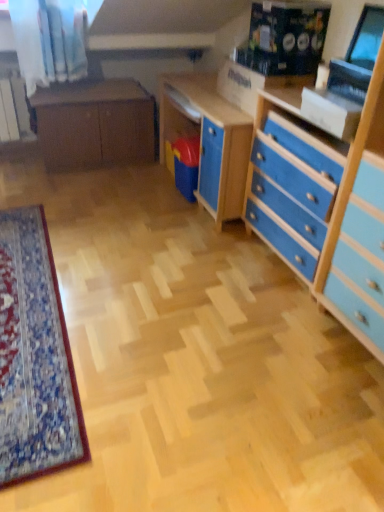
Question: Is blue painted wood chest of drawers at right at the left side of matte brown cabinet at center?

Choices:
 (A) yes
 (B) no

Answer: (B)

Question: From a real-world perspective, is blue painted wood chest of drawers at right on matte brown cabinet at center?

Choices:
 (A) yes
 (B) no

Answer: (A)

Question: Is blue painted wood chest of drawers at right next to matte brown cabinet at center?

Choices:
 (A) no
 (B) yes

Answer: (A)

Question: Is blue painted wood chest of drawers at right thinner than matte brown cabinet at center?

Choices:
 (A) no
 (B) yes

Answer: (B)

Question: Considering the relative sizes of blue painted wood chest of drawers at right and matte brown cabinet at center in the image provided, is blue painted wood chest of drawers at right smaller than matte brown cabinet at center?

Choices:
 (A) no
 (B) yes

Answer: (B)

Question: Is blue painted wood chest of drawers at right turned away from matte brown cabinet at center?

Choices:
 (A) yes
 (B) no

Answer: (B)

Question: From a real-world perspective, is matte black monitor at upper right physically below blue painted wood chest of drawers at right?

Choices:
 (A) yes
 (B) no

Answer: (B)

Question: Is matte black monitor at upper right closer to camera compared to blue painted wood chest of drawers at right?

Choices:
 (A) no
 (B) yes

Answer: (A)

Question: Considering the relative positions of matte black monitor at upper right and blue painted wood chest of drawers at right in the image provided, is matte black monitor at upper right to the right of blue painted wood chest of drawers at right from the viewer's perspective?

Choices:
 (A) yes
 (B) no

Answer: (A)

Question: From a real-world perspective, is matte black monitor at upper right over blue painted wood chest of drawers at right?

Choices:
 (A) yes
 (B) no

Answer: (A)

Question: Is matte black monitor at upper right to the left of blue painted wood chest of drawers at right from the viewer's perspective?

Choices:
 (A) no
 (B) yes

Answer: (A)

Question: Is matte black monitor at upper right directly adjacent to blue painted wood chest of drawers at right?

Choices:
 (A) yes
 (B) no

Answer: (B)

Question: Are matte brown cabinet at center and matte black monitor at upper right far apart?

Choices:
 (A) no
 (B) yes

Answer: (B)